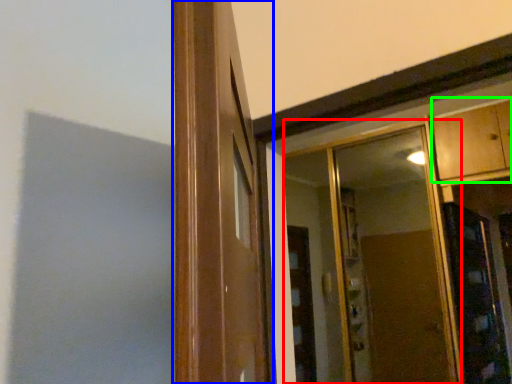
Question: Based on their relative distances, which object is farther from mirror (highlighted by a red box)? Choose from window frame (highlighted by a blue box) and cabinetry (highlighted by a green box).

Choices:
 (A) window frame
 (B) cabinetry

Answer: (A)